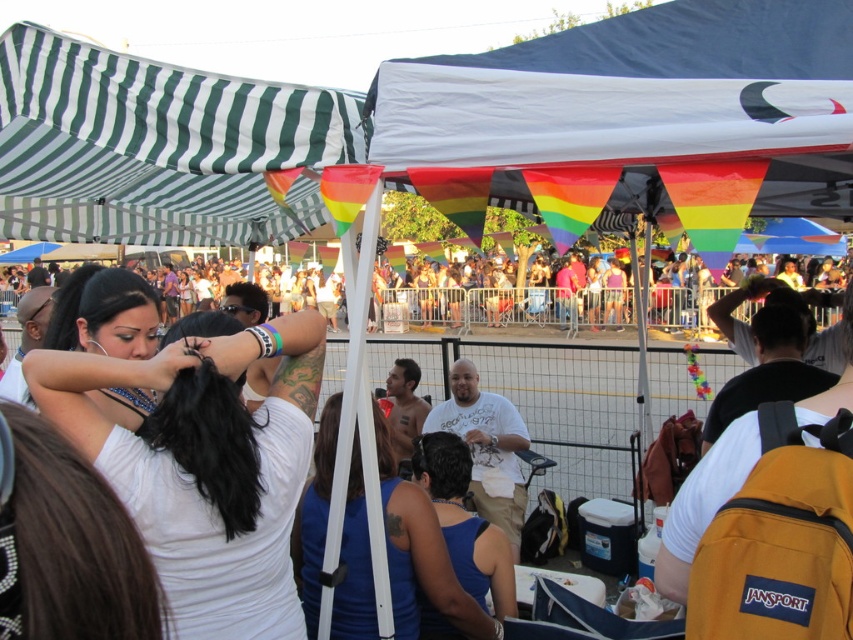
Based on the scene description, which object is shorter in height between the smooth black hair at center and the multicolored fabric crowd at center?

The smooth black hair at center is shorter in height compared to the multicolored fabric crowd at center.

You are standing at the center of the image and want to locate the smooth black hair at center. What are the coordinates where you should look?

The smooth black hair at center is located at coordinates point [202,461].

You are standing at the center of the image and see a point marked at coordinates (202, 461). What is the color of the hair at that point?

The point at (202, 461) is on smooth black hair at center, so the color is black.